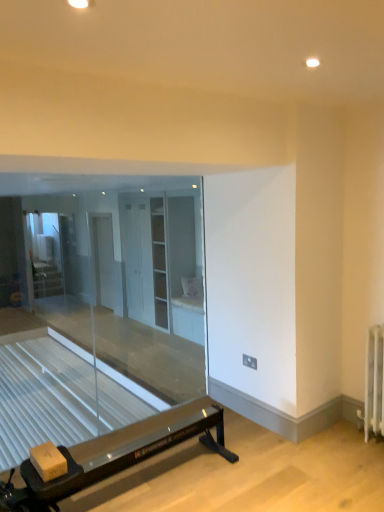
Question: Would you say white glossy cabinet at center, which is the 2th screen door in left-to-right order, is outside transparent glass door at left?

Choices:
 (A) no
 (B) yes

Answer: (B)

Question: From a real-world perspective, is white glossy cabinet at center, marked as the 1th screen door in a front-to-back arrangement, positioned over transparent glass door at left based on gravity?

Choices:
 (A) yes
 (B) no

Answer: (B)

Question: Is white glossy cabinet at center, positioned as the 2th screen door in back-to-front order, further to camera compared to transparent glass door at left?

Choices:
 (A) yes
 (B) no

Answer: (B)

Question: Is transparent glass door at left completely or partially inside white glossy cabinet at center, marked as the 1th screen door in a front-to-back arrangement?

Choices:
 (A) yes
 (B) no

Answer: (B)

Question: Is the depth of white glossy cabinet at center, marked as the 1th screen door in a front-to-back arrangement, less than that of transparent glass door at left?

Choices:
 (A) no
 (B) yes

Answer: (B)

Question: Is white glossy cabinet at center, marked as the 1th screen door in a front-to-back arrangement, to the right of transparent glass door at left from the viewer's perspective?

Choices:
 (A) yes
 (B) no

Answer: (A)

Question: Considering the relative positions of white glossy cabinet at center, positioned as the 2th screen door in back-to-front order, and white glossy screen door at center, the 1th screen door in the back-to-front sequence, in the image provided, is white glossy cabinet at center, positioned as the 2th screen door in back-to-front order, in front of white glossy screen door at center, the 1th screen door in the back-to-front sequence,?

Choices:
 (A) no
 (B) yes

Answer: (B)

Question: Is white glossy cabinet at center, which is the 2th screen door in left-to-right order, outside white glossy screen door at center, the 1th screen door in the back-to-front sequence?

Choices:
 (A) no
 (B) yes

Answer: (B)

Question: Is white glossy cabinet at center, placed as the first screen door when sorted from right to left, bigger than white glossy screen door at center, the second screen door in the right-to-left sequence?

Choices:
 (A) no
 (B) yes

Answer: (B)

Question: Is white glossy cabinet at center, which is the 2th screen door in left-to-right order, wider than white glossy screen door at center, placed as the 1th screen door when sorted from left to right?

Choices:
 (A) yes
 (B) no

Answer: (A)

Question: Can you confirm if white glossy cabinet at center, marked as the 1th screen door in a front-to-back arrangement, is thinner than white glossy screen door at center, the 2th screen door positioned from the front?

Choices:
 (A) yes
 (B) no

Answer: (B)

Question: Is white glossy cabinet at center, placed as the first screen door when sorted from right to left, facing towards white glossy screen door at center, the 1th screen door in the back-to-front sequence?

Choices:
 (A) no
 (B) yes

Answer: (A)

Question: Is transparent glass door at left a part of white glossy screen door at center, the second screen door in the right-to-left sequence?

Choices:
 (A) yes
 (B) no

Answer: (B)